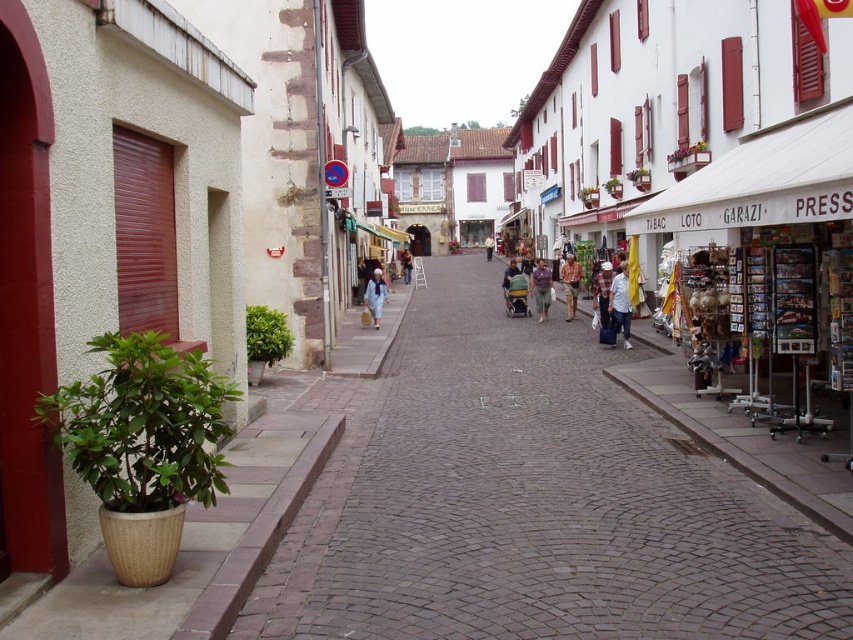
You are a delivery person who needs to place a package between the light blue denim jeans at center and the light blue denim jacket at center. The package requires 4 meters of space. Is there enough space?

The light blue denim jeans at center and the light blue denim jacket at center are 43.39 meters apart, so yes, there is more than enough space to place the package between them as 43.39 meters is greater than 4 meters.

You are a tourist standing on the cobblestone street and see both the khaki cotton shorts at center and the matte blue coat at center. Which item is positioned lower in the scene?

The khaki cotton shorts at center is located below the matte blue coat at center, so it is positioned lower in the scene.